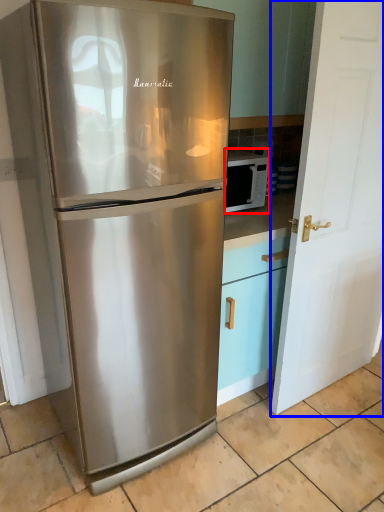
Question: Which object is further to the camera taking this photo, microwave oven (highlighted by a red box) or door (highlighted by a blue box)?

Choices:
 (A) microwave oven
 (B) door

Answer: (A)